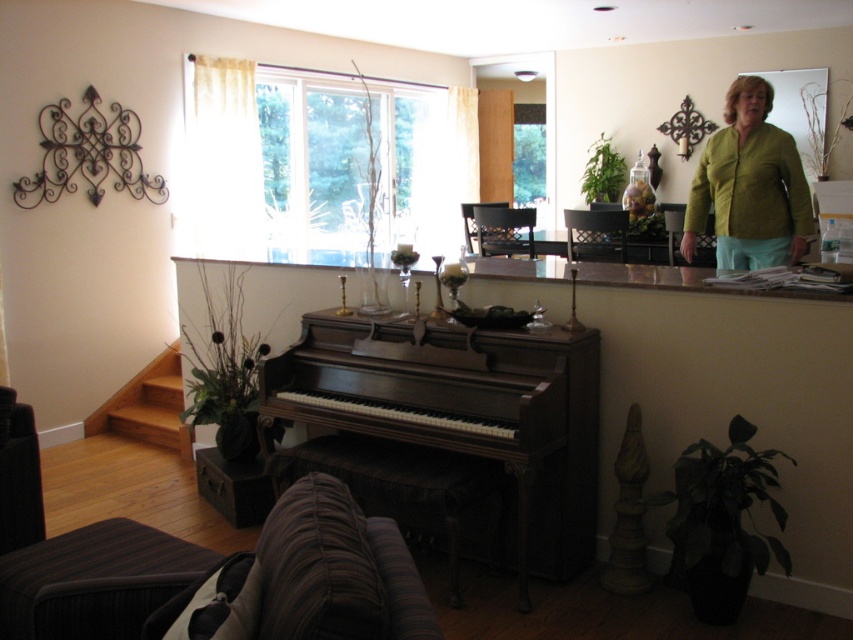
You are a visitor in the living room and want to place a small vase on the highest point between the dark wood piano at center and the green textured blouse at upper right. Which object should you choose?

The dark wood piano at center has a greater height compared to the green textured blouse at upper right, so you should place the vase on the dark wood piano at center.

You are a guest in the living room and need to sit down. You see the brown fabric stool at lower left and the green textured blouse at upper right. Which one is shorter and more suitable for sitting?

The brown fabric stool at lower left is shorter than the green textured blouse at upper right, making it more suitable for sitting.

Looking at this image, you are standing in the living room and want to sit on the brown leather stool at lower center. Which object do you need to walk around first, the dark wood piano at center or the staircase on the left?

You need to walk around the dark wood piano at center first because it is closer to you than the brown leather stool at lower center, so you must move past the piano to reach the stool.